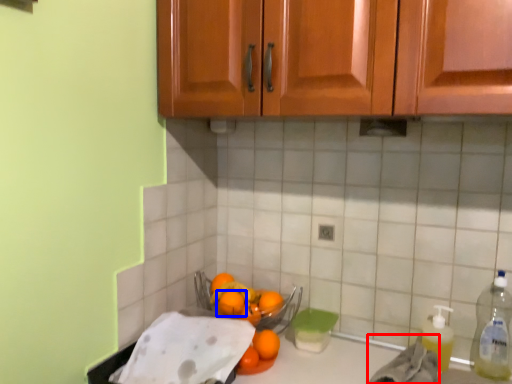
Question: Which point is closer to the camera, material (highlighted by a red box) or orange (highlighted by a blue box)?

Choices:
 (A) material
 (B) orange

Answer: (A)